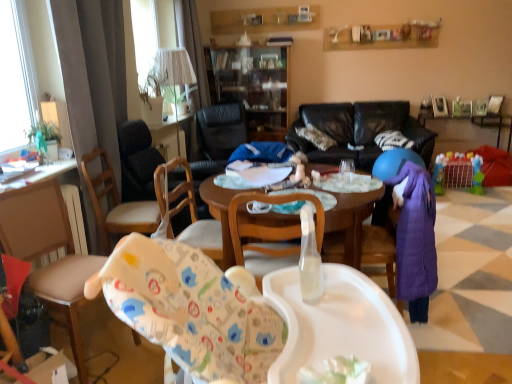
Question: Is white fabric lampshade at upper center bigger than black leather chair at center, placed as the 4th chair when sorted from front to back?

Choices:
 (A) yes
 (B) no

Answer: (B)

Question: Is black leather chair at center, placed as the 4th chair when sorted from front to back, at the back of white fabric lampshade at upper center?

Choices:
 (A) yes
 (B) no

Answer: (B)

Question: Is white fabric lampshade at upper center at the left side of black leather chair at center, placed as the 4th chair when sorted from front to back?

Choices:
 (A) no
 (B) yes

Answer: (B)

Question: Is white fabric lampshade at upper center positioned behind black leather chair at center, placed as the 4th chair when sorted from front to back?

Choices:
 (A) no
 (B) yes

Answer: (B)

Question: From the image's perspective, is white fabric lampshade at upper center beneath black leather chair at center, the 1th chair in the back-to-front sequence?

Choices:
 (A) no
 (B) yes

Answer: (A)

Question: Is black leather chair at center, placed as the 4th chair when sorted from front to back, in front of or behind white glossy table at left, which appears as the 1th table when ordered from the bottom, in the image?

Choices:
 (A) behind
 (B) front

Answer: (A)

Question: Is black leather chair at center, the 1th chair in the back-to-front sequence, bigger or smaller than white glossy table at left, acting as the 2th table starting from the back?

Choices:
 (A) small
 (B) big

Answer: (B)

Question: Choose the correct answer: Is black leather chair at center, the 1th chair in the back-to-front sequence, inside white glossy table at left, which appears as the 1th table when ordered from the bottom, or outside it?

Choices:
 (A) outside
 (B) inside

Answer: (A)

Question: In terms of height, does black leather chair at center, placed as the 4th chair when sorted from front to back, look taller or shorter compared to white glossy table at left, which appears as the 1th table when ordered from the bottom?

Choices:
 (A) tall
 (B) short

Answer: (A)

Question: In terms of width, does black leather couch at center look wider or thinner when compared to plastic colorful playpen at right?

Choices:
 (A) wide
 (B) thin

Answer: (A)

Question: Is black leather couch at center in front of or behind plastic colorful playpen at right in the image?

Choices:
 (A) front
 (B) behind

Answer: (B)

Question: Is black leather couch at center situated inside plastic colorful playpen at right or outside?

Choices:
 (A) outside
 (B) inside

Answer: (A)

Question: In terms of height, does black leather couch at center look taller or shorter compared to plastic colorful playpen at right?

Choices:
 (A) short
 (B) tall

Answer: (B)

Question: From the image's perspective, relative to white fabric lampshade at upper center, is plastic toy basket at lower right, acting as the 1th table starting from the back, above or below?

Choices:
 (A) above
 (B) below

Answer: (B)

Question: Is plastic toy basket at lower right, which is the 1th table in top-to-bottom order, inside or outside of white fabric lampshade at upper center?

Choices:
 (A) inside
 (B) outside

Answer: (B)